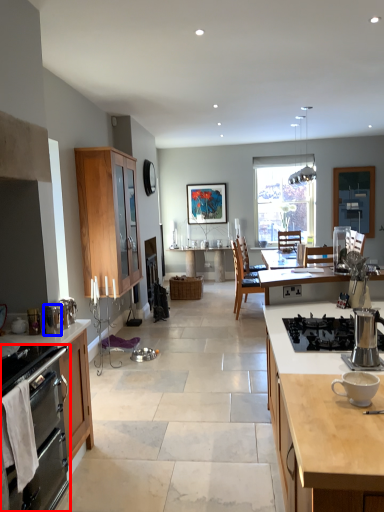
Question: Which of the following is the farthest to the observer, kitchen appliance (highlighted by a red box) or appliance (highlighted by a blue box)?

Choices:
 (A) kitchen appliance
 (B) appliance

Answer: (B)